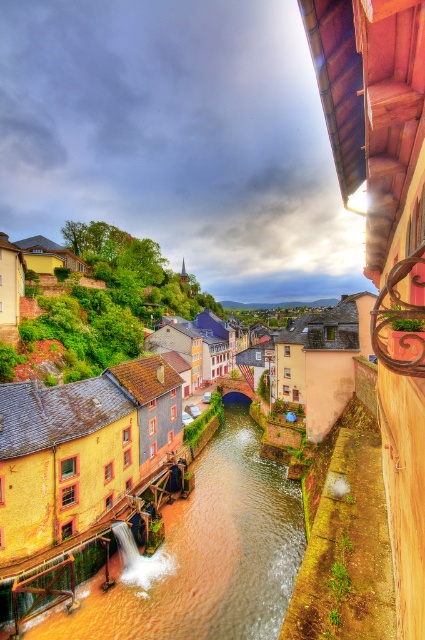
Does brown smooth water at lower center have a smaller size compared to yellow matte building at center?

Yes.

Is brown smooth water at lower center taller than yellow matte building at center?

No.

Is point (116, 561) positioned before point (37, 544)?

No, it is not.

I want to click on brown smooth water at lower center, so 204,554.